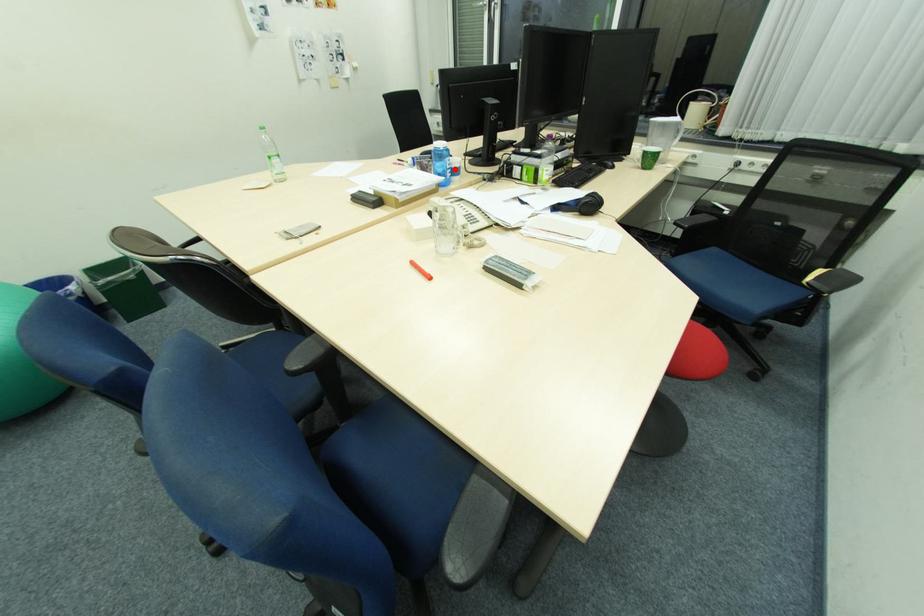
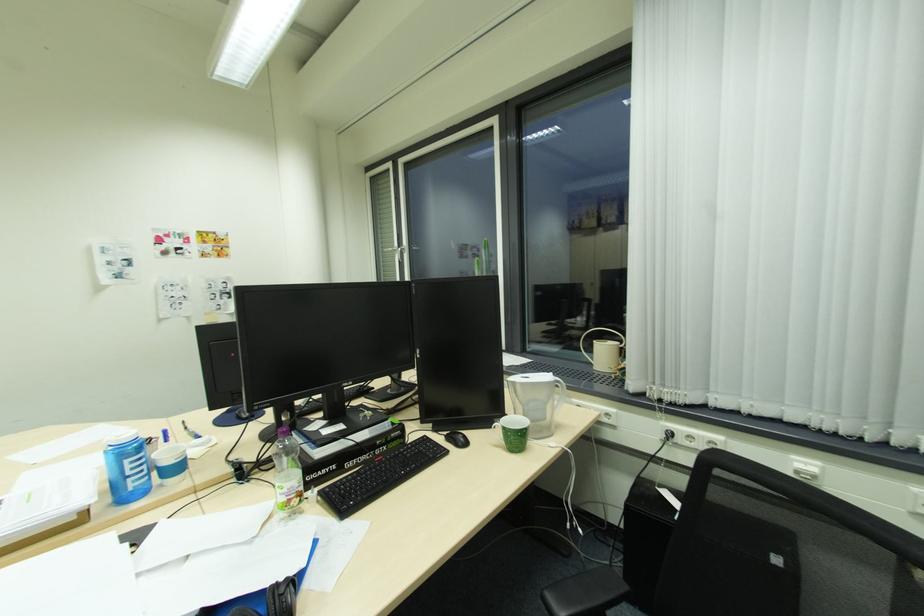
In the second image, find the point that corresponds to the highlighted location in the first image.

(146, 472)